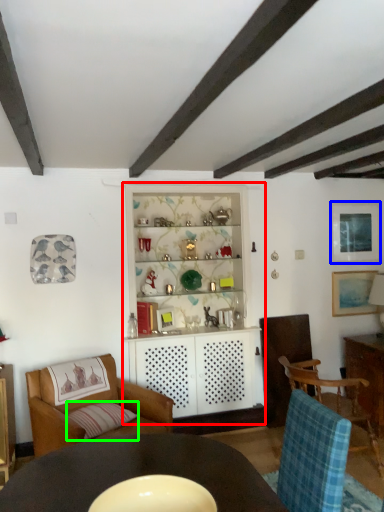
Question: Which object is the farthest from dresser (highlighted by a red box)? Choose among these: picture frame (highlighted by a blue box) or pillow (highlighted by a green box).

Choices:
 (A) picture frame
 (B) pillow

Answer: (A)